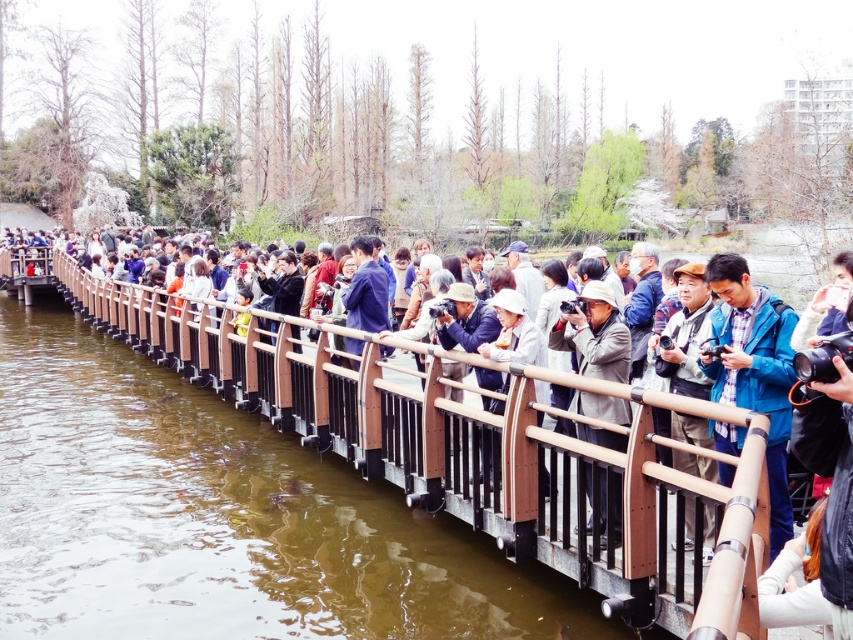
Is matte brown camera at center wider than white matte hat at center?

Incorrect, matte brown camera at center's width does not surpass white matte hat at center's.

Is matte brown camera at center taller than white matte hat at center?

Indeed, matte brown camera at center has a greater height compared to white matte hat at center.

This screenshot has height=640, width=853. I want to click on matte brown camera at center, so click(x=685, y=333).

The image size is (853, 640). In order to click on matte brown camera at center in this screenshot , I will do `click(685, 333)`.

Who is positioned more to the left, brown wooden bridge at center or white matte hat at center?

Positioned to the left is brown wooden bridge at center.

Can you confirm if brown wooden bridge at center is positioned below white matte hat at center?

Yes.

Is point (91, 634) less distant than point (508, 321)?

Yes, point (91, 634) is closer to viewer.

Locate an element on the screen. This screenshot has height=640, width=853. brown wooden bridge at center is located at coordinates (219, 516).

Is gray fabric hat at center positioned in front of matte brown camera at center?

No, gray fabric hat at center is behind matte brown camera at center.

Does point (598, 432) come farther from viewer compared to point (677, 360)?

Yes, it is.

In order to click on gray fabric hat at center in this screenshot , I will do `click(595, 333)`.